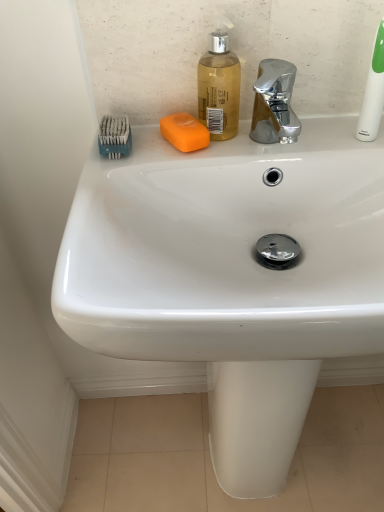
Question: Is white plastic toothbrush at upper right taller or shorter than translucent plastic soap dispenser at upper center?

Choices:
 (A) short
 (B) tall

Answer: (B)

Question: From the image's perspective, is white plastic toothbrush at upper right above or below translucent plastic soap dispenser at upper center?

Choices:
 (A) above
 (B) below

Answer: (A)

Question: Estimate the real-world distances between objects in this image. Which object is closer to the white plastic toothbrush at upper right?

Choices:
 (A) orange matte soap at center
 (B) teal plastic toothbrush at upper left
 (C) translucent plastic soap dispenser at upper center

Answer: (C)

Question: Which of these objects is positioned farthest from the orange matte soap at center?

Choices:
 (A) translucent plastic soap dispenser at upper center
 (B) teal plastic toothbrush at upper left
 (C) white plastic toothbrush at upper right

Answer: (C)